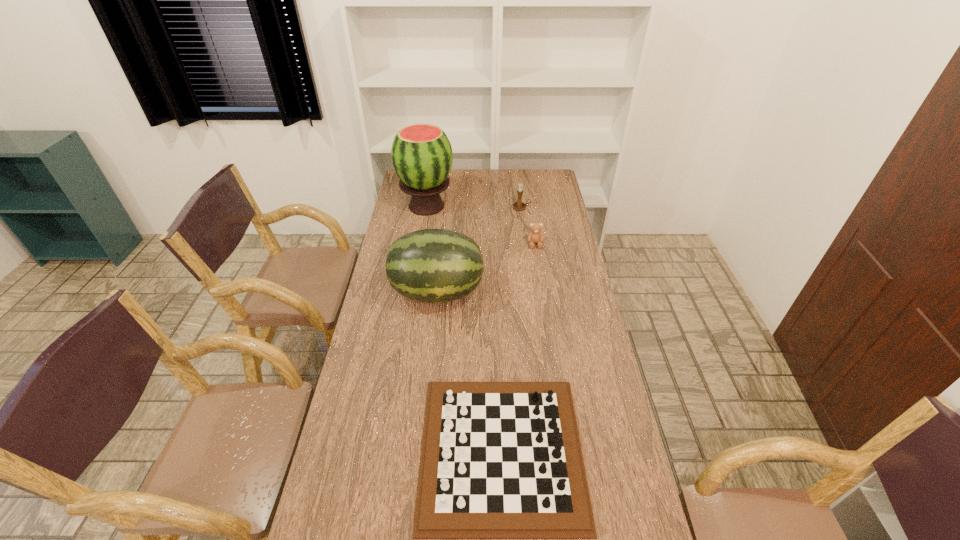
You are a GUI agent. You are given a task and a screenshot of the screen. Output one action in this format:
    pyautogui.click(x=<x>, y=<y>)
    Task: Click on the free space at the right edge
    
    Given the screenshot: What is the action you would take?
    pyautogui.click(x=571, y=361)

This screenshot has height=540, width=960. I want to click on vacant space at the far right corner of the desktop, so click(x=534, y=172).

Locate an element on the screen. This screenshot has width=960, height=540. vacant area between the fourth shortest object and the nearest object is located at coordinates (469, 372).

The image size is (960, 540). In order to click on vacant region between the farther watermelon and the third shortest object in this screenshot , I will do `click(474, 207)`.

In order to click on unoccupied position between the second nearest object and the gameboard in this screenshot , I will do `click(469, 372)`.

The height and width of the screenshot is (540, 960). What are the coordinates of `free space between the teddy bear and the nearer watermelon` in the screenshot? It's located at (486, 268).

Where is `free point between the second shortest object and the shortest object`? This screenshot has height=540, width=960. free point between the second shortest object and the shortest object is located at coordinates (518, 347).

Identify the location of free space between the third tallest object and the farther watermelon. The height and width of the screenshot is (540, 960). (474, 207).

This screenshot has width=960, height=540. What are the coordinates of `object that stands as the closest to the taller watermelon` in the screenshot? It's located at (519, 205).

Identify the location of object that is the second nearest to the shorter watermelon. (500, 460).